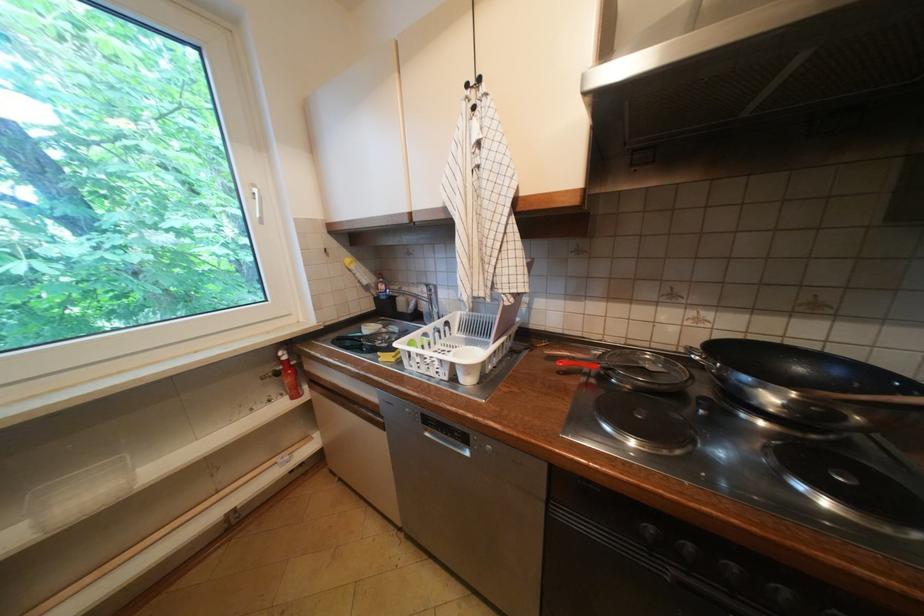
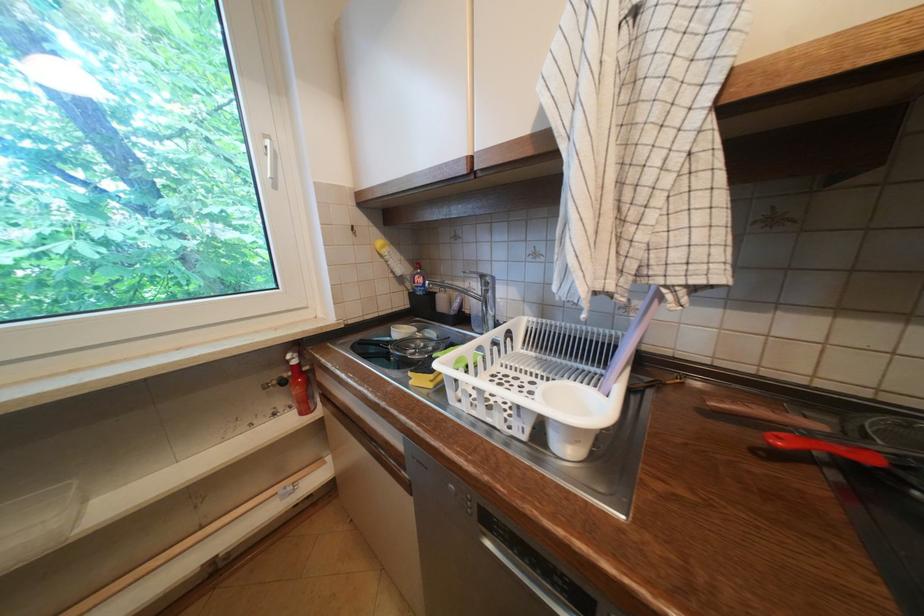
In the second image, find the point that corresponds to (569,363) in the first image.

(788, 440)